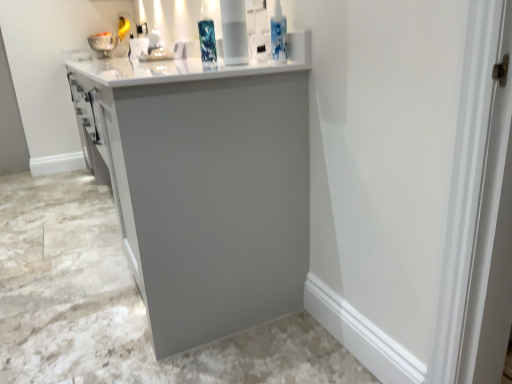
The height and width of the screenshot is (384, 512). What do you see at coordinates (150, 48) in the screenshot?
I see `white glossy sink at upper center` at bounding box center [150, 48].

Describe the element at coordinates (208, 187) in the screenshot. I see `matte gray cabinet at center` at that location.

The width and height of the screenshot is (512, 384). I want to click on white glossy sink at upper center, so click(150, 48).

Can you see matte gray cabinet at center touching white glossy vase at upper center?

No, matte gray cabinet at center is not beside white glossy vase at upper center.

Between point (70, 82) and point (238, 27), which one is positioned in front?

The point (238, 27) is closer to the camera.

Can we say matte gray cabinet at center lies outside white glossy vase at upper center?

Yes, matte gray cabinet at center is not within white glossy vase at upper center.

Image resolution: width=512 pixels, height=384 pixels. I want to click on appliance behind the matte gray cabinet at center, so click(x=234, y=32).

Based on the photo, measure the distance from white glossy vase at upper center to white glossy sink at upper center.

white glossy vase at upper center is 1.31 meters away from white glossy sink at upper center.

Considering their positions, is white glossy vase at upper center located in front of or behind white glossy sink at upper center?

In the image, white glossy vase at upper center appears in front of white glossy sink at upper center.

How many degrees apart are the facing directions of white glossy vase at upper center and white glossy sink at upper center?

white glossy vase at upper center and white glossy sink at upper center are facing 4.33 degrees away from each other.

Does point (230, 36) come closer to viewer compared to point (151, 58)?

Yes, it is in front of point (151, 58).

Does white glossy sink at upper center have a greater width compared to white glossy vase at upper center?

Yes, white glossy sink at upper center is wider than white glossy vase at upper center.

Which is more to the left, white glossy sink at upper center or white glossy vase at upper center?

white glossy sink at upper center is more to the left.

Where is `appliance below the white glossy sink at upper center (from the image's perspective)`? The height and width of the screenshot is (384, 512). appliance below the white glossy sink at upper center (from the image's perspective) is located at coordinates (234, 32).

Can you tell me how much matte gray cabinet at center and white glossy sink at upper center differ in facing direction?

There is a 0.633-degree angle between the facing directions of matte gray cabinet at center and white glossy sink at upper center.

Could you tell me if matte gray cabinet at center is facing white glossy sink at upper center?

No.

From a real-world perspective, does matte gray cabinet at center stand above white glossy sink at upper center?

No, from a real-world perspective, matte gray cabinet at center is not on top of white glossy sink at upper center.

At what (x,y) coordinates should I click in order to perform the action: click on cabinetry located on the left of white glossy sink at upper center. Please return your answer as a coordinate pair (x, y). This screenshot has height=384, width=512. Looking at the image, I should click on click(x=208, y=187).

Is point (225, 35) more distant than point (282, 94)?

Yes, it is.

Is white glossy vase at upper center positioned far away from matte gray cabinet at center?

No.

Which object is wider, white glossy vase at upper center or matte gray cabinet at center?

With larger width is matte gray cabinet at center.

Is white glossy vase at upper center positioned beyond the bounds of matte gray cabinet at center?

No, white glossy vase at upper center is inside or overlapping with matte gray cabinet at center.

Is point (155, 58) farther from viewer compared to point (191, 305)?

Yes, point (155, 58) is behind point (191, 305).

From the image's perspective, is white glossy sink at upper center positioned above or below matte gray cabinet at center?

Based on their image positions, white glossy sink at upper center is located above matte gray cabinet at center.

Would you say white glossy sink at upper center contains matte gray cabinet at center?

Definitely not — matte gray cabinet at center is not inside white glossy sink at upper center.

Based on the photo, would you say white glossy sink at upper center is to the left or to the right of matte gray cabinet at center in the picture?

white glossy sink at upper center is to the right of matte gray cabinet at center.

Where is `cabinetry below the white glossy vase at upper center (from the image's perspective)`? This screenshot has height=384, width=512. cabinetry below the white glossy vase at upper center (from the image's perspective) is located at coordinates (208, 187).

At what (x,y) coordinates should I click in order to perform the action: click on sink below the white glossy vase at upper center (from a real-world perspective). Please return your answer as a coordinate pair (x, y). The height and width of the screenshot is (384, 512). Looking at the image, I should click on (150, 48).

Looking at the image, which one is located further to matte gray cabinet at center, white glossy vase at upper center or white glossy sink at upper center?

The object further to matte gray cabinet at center is white glossy sink at upper center.

Estimate the real-world distances between objects in this image. Which object is further from white glossy vase at upper center, matte gray cabinet at center or white glossy sink at upper center?

white glossy sink at upper center.

Looking at this image, which object lies nearer to the anchor point white glossy sink at upper center, matte gray cabinet at center or white glossy vase at upper center?

white glossy vase at upper center is positioned closer to the anchor white glossy sink at upper center.

Based on the photo, considering their positions, is white glossy sink at upper center positioned closer to white glossy vase at upper center than matte gray cabinet at center?

Based on the image, matte gray cabinet at center appears to be nearer to white glossy vase at upper center.

Considering their positions, is white glossy sink at upper center positioned further to matte gray cabinet at center than white glossy vase at upper center?

white glossy sink at upper center.

Which object lies further to the anchor point white glossy sink at upper center, white glossy vase at upper center or matte gray cabinet at center?

matte gray cabinet at center is further to white glossy sink at upper center.

You are a GUI agent. You are given a task and a screenshot of the screen. Output one action in this format:
    pyautogui.click(x=<x>, y=<y>)
    Task: Click on the appliance between matte gray cabinet at center and white glossy sink at upper center in the front-back direction
    
    Given the screenshot: What is the action you would take?
    234,32